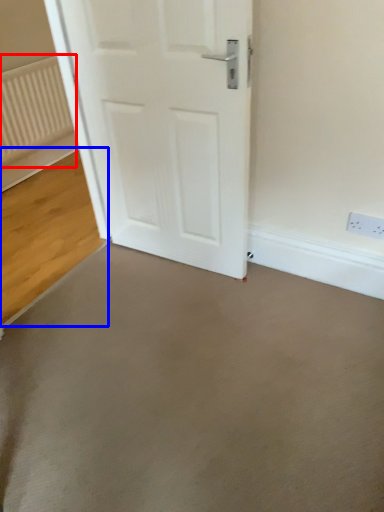
Question: Which object appears farthest to the camera in this image, radiator (highlighted by a red box) or concrete (highlighted by a blue box)?

Choices:
 (A) radiator
 (B) concrete

Answer: (A)